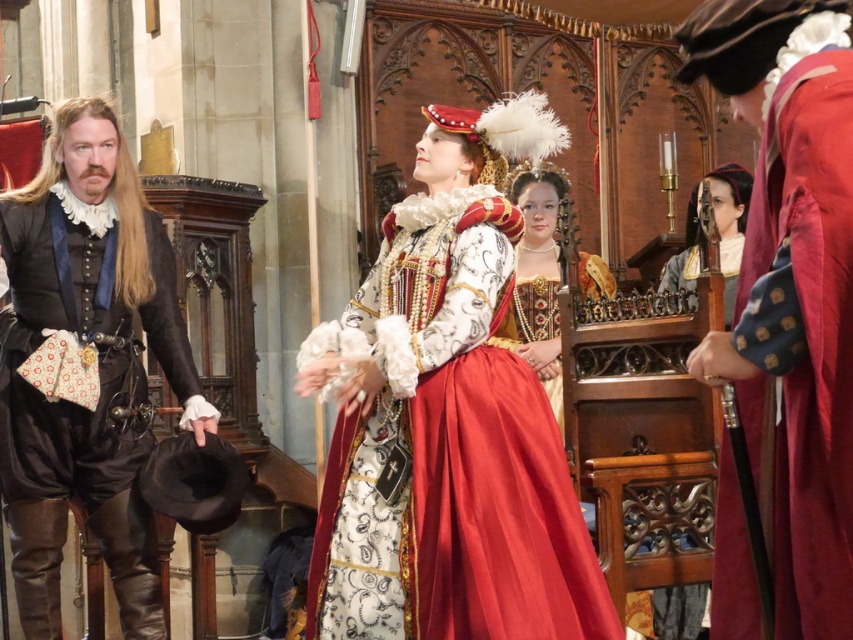
Question: Is velvet maroon robe at right positioned at the back of silk lace collar at upper center?

Choices:
 (A) yes
 (B) no

Answer: (B)

Question: Which of the following is the closest to the observer?

Choices:
 (A) (733, 576)
 (B) (26, 346)
 (C) (694, 300)
 (D) (346, 384)

Answer: (A)

Question: Which of these objects is positioned closest to the velvet maroon robe at right?

Choices:
 (A) silk lace collar at upper center
 (B) matte white lace dress at center
 (C) matte black vest at left

Answer: (B)

Question: From the image, what is the correct spatial relationship of matte white lace dress at center in relation to silk lace collar at upper center?

Choices:
 (A) right
 (B) left

Answer: (B)

Question: Which point is closer to the camera?

Choices:
 (A) (49, 262)
 (B) (430, 109)
 (C) (845, 602)

Answer: (C)

Question: Is matte black vest at left further to camera compared to silk lace collar at upper center?

Choices:
 (A) no
 (B) yes

Answer: (B)